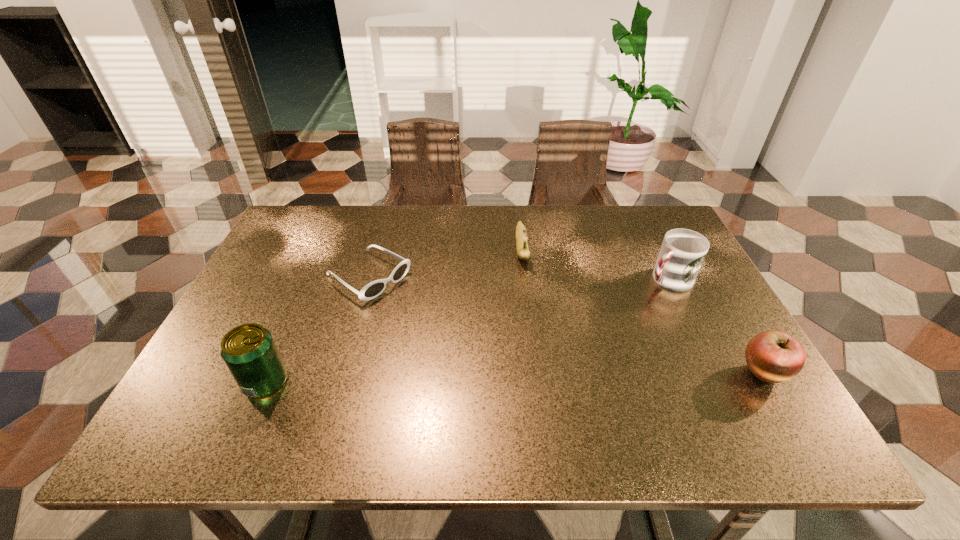
Find the location of a particular element. beer can is located at coordinates (248, 350).

Where is `apple`? The width and height of the screenshot is (960, 540). apple is located at coordinates (773, 356).

Identify the location of the third object from left to right. (523, 252).

Locate an element on the screen. The height and width of the screenshot is (540, 960). sunglasses is located at coordinates (372, 290).

Identify the location of cup. Image resolution: width=960 pixels, height=540 pixels. (682, 253).

This screenshot has height=540, width=960. In order to click on free location located on the back of the beer can in this screenshot , I will do `click(284, 341)`.

The image size is (960, 540). In order to click on vacant region located on the back of the apple in this screenshot , I will do `click(724, 308)`.

Identify the location of vacant point located at the stem of the banana. (533, 342).

You are a GUI agent. You are given a task and a screenshot of the screen. Output one action in this format:
    pyautogui.click(x=<x>, y=<y>)
    Task: Click on the free space located 0.360m at the stem of the banana
    This screenshot has height=540, width=960.
    Given the screenshot: What is the action you would take?
    coord(536,374)

What are the coordinates of `vacant point located 0.320m at the stem of the banana` in the screenshot? It's located at (535, 360).